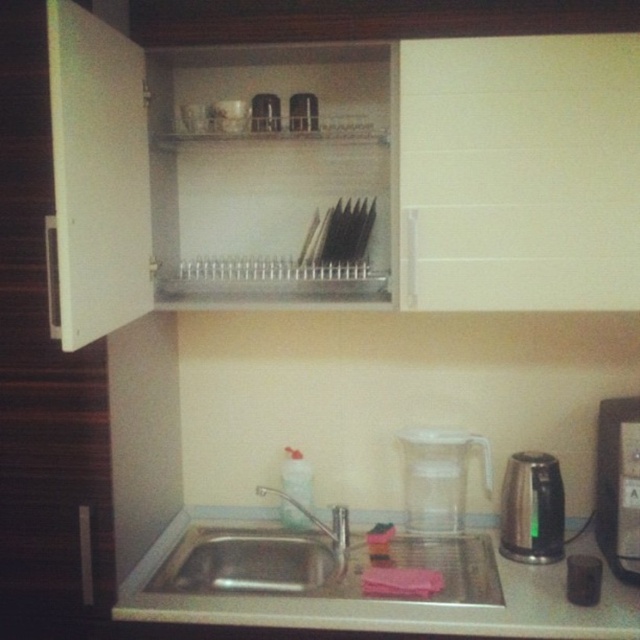
You are trying to place a small salt shaker on the surface that is lower between the white glossy counter top at lower center and the black plastic coffee machine at right. Which surface should you choose?

The white glossy counter top at lower center is shorter than the black plastic coffee machine at right, so the salt shaker should be placed on the white glossy counter top at lower center since it is the lower surface.

You are trying to determine if the stainless steel kettle at right can fit into the cabinet above the stainless steel sink at lower center. Based on their heights, will it fit vertically?

The stainless steel sink at lower center is not as tall as the stainless steel kettle at right, meaning the kettle is taller. Since the cabinet has shelves, the vertical space between shelves may be limited. If the kettle is taller than the space between the shelves, it might not fit vertically. However, without specific measurements of the shelf spacing, we can only confirm the kettle is taller than the sink, but cannot definitively determine if it fits in the cabinet.

You are a delivery person who just arrived at the house. You need to place a new stainless steel sink at lower center in the kitchen. Where should you place it?

The stainless steel sink at lower center should be placed at point (259,560).